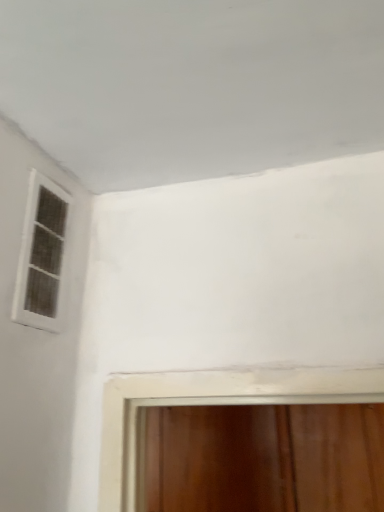
You are a GUI agent. You are given a task and a screenshot of the screen. Output one action in this format:
    pyautogui.click(x=<x>, y=<y>)
    Task: Click on the white matte window at upper left, arranged as the 1th window when viewed from the front
    The height and width of the screenshot is (512, 384).
    Given the screenshot: What is the action you would take?
    pyautogui.click(x=43, y=256)

What do you see at coordinates (43, 256) in the screenshot? This screenshot has width=384, height=512. I see `white matte window at upper left, the 2th window positioned from the right` at bounding box center [43, 256].

Where is `transparent glass door at bottom, the first window positioned from the bottom`? This screenshot has height=512, width=384. transparent glass door at bottom, the first window positioned from the bottom is located at coordinates (210, 404).

What do you see at coordinates (210, 404) in the screenshot?
I see `transparent glass door at bottom, the first window when ordered from back to front` at bounding box center [210, 404].

Locate an element on the screen. The height and width of the screenshot is (512, 384). white matte window at upper left, the 2th window positioned from the right is located at coordinates click(43, 256).

Which is more to the left, white matte window at upper left, marked as the second window in a back-to-front arrangement, or transparent glass door at bottom, the first window positioned from the bottom?

Positioned to the left is white matte window at upper left, marked as the second window in a back-to-front arrangement.

Between white matte window at upper left, arranged as the second window when ordered from the bottom, and transparent glass door at bottom, the first window positioned from the bottom, which one is positioned in front?

white matte window at upper left, arranged as the second window when ordered from the bottom, is closer to the camera.

Is point (58, 227) closer or farther from the camera than point (105, 507)?

Point (58, 227) appears to be farther away from the viewer than point (105, 507).

From the image's perspective, is white matte window at upper left, which appears as the first window when viewed from the left, positioned above or below transparent glass door at bottom, the first window positioned from the bottom?

Clearly, from the image's perspective, white matte window at upper left, which appears as the first window when viewed from the left, is above transparent glass door at bottom, the first window positioned from the bottom.

From a real-world perspective, is white matte window at upper left, arranged as the 1th window when viewed from the front, on top of transparent glass door at bottom, the 1th window in the right-to-left sequence?

Yes.

Does white matte window at upper left, which appears as the first window when viewed from the left, have a greater width compared to transparent glass door at bottom, the 2th window positioned from the front?

Incorrect, the width of white matte window at upper left, which appears as the first window when viewed from the left, does not surpass that of transparent glass door at bottom, the 2th window positioned from the front.

Who is taller, white matte window at upper left, arranged as the 1th window when viewed from the front, or transparent glass door at bottom, the 1th window in the right-to-left sequence?

transparent glass door at bottom, the 1th window in the right-to-left sequence, is taller.

Which of these two, white matte window at upper left, which appears as the first window when viewed from the left, or transparent glass door at bottom, the first window positioned from the bottom, is smaller?

With smaller size is white matte window at upper left, which appears as the first window when viewed from the left.

Would you say white matte window at upper left, which appears as the first window when viewed from the left, is inside or outside transparent glass door at bottom, placed as the 2th window when sorted from left to right?

white matte window at upper left, which appears as the first window when viewed from the left, is outside transparent glass door at bottom, placed as the 2th window when sorted from left to right.

Is white matte window at upper left, marked as the second window in a back-to-front arrangement, positioned far away from transparent glass door at bottom, the 2th window from the top?

No, white matte window at upper left, marked as the second window in a back-to-front arrangement, is not far from transparent glass door at bottom, the 2th window from the top.

Does white matte window at upper left, which appears as the first window when viewed from the left, turn towards transparent glass door at bottom, the first window when ordered from back to front?

No, white matte window at upper left, which appears as the first window when viewed from the left, is not aimed at transparent glass door at bottom, the first window when ordered from back to front.

Can you tell me how much white matte window at upper left, marked as the first window in a top-to-bottom arrangement, and transparent glass door at bottom, the 1th window in the right-to-left sequence, differ in facing direction?

They differ by 89.1 degrees in their facing directions.

The width and height of the screenshot is (384, 512). I want to click on window lying on the left of transparent glass door at bottom, placed as the 2th window when sorted from left to right, so click(43, 256).

In the scene shown: Which is more to the right, transparent glass door at bottom, the 2th window from the top, or white matte window at upper left, marked as the second window in a back-to-front arrangement?

From the viewer's perspective, transparent glass door at bottom, the 2th window from the top, appears more on the right side.

Is transparent glass door at bottom, the first window when ordered from back to front, closer to camera compared to white matte window at upper left, the 2th window positioned from the right?

No, transparent glass door at bottom, the first window when ordered from back to front, is behind white matte window at upper left, the 2th window positioned from the right.

Which point is more forward, (111,450) or (35,255)?

Positioned in front is point (35,255).

From the image's perspective, which is below, transparent glass door at bottom, the first window positioned from the bottom, or white matte window at upper left, arranged as the 1th window when viewed from the front?

transparent glass door at bottom, the first window positioned from the bottom, is shown below in the image.

From a real-world perspective, is transparent glass door at bottom, the 1th window in the right-to-left sequence, positioned under white matte window at upper left, marked as the first window in a top-to-bottom arrangement, based on gravity?

Indeed, from a real-world perspective, transparent glass door at bottom, the 1th window in the right-to-left sequence, is positioned beneath white matte window at upper left, marked as the first window in a top-to-bottom arrangement.

Considering the relative sizes of transparent glass door at bottom, the first window when ordered from back to front, and white matte window at upper left, the 2th window positioned from the right, in the image provided, is transparent glass door at bottom, the first window when ordered from back to front, wider than white matte window at upper left, the 2th window positioned from the right,?

Correct, the width of transparent glass door at bottom, the first window when ordered from back to front, exceeds that of white matte window at upper left, the 2th window positioned from the right.

Is transparent glass door at bottom, the 2th window from the top, shorter than white matte window at upper left, the 2th window positioned from the right?

In fact, transparent glass door at bottom, the 2th window from the top, may be taller than white matte window at upper left, the 2th window positioned from the right.

Is transparent glass door at bottom, the first window positioned from the bottom, bigger than white matte window at upper left, the 2th window positioned from the right?

Indeed, transparent glass door at bottom, the first window positioned from the bottom, has a larger size compared to white matte window at upper left, the 2th window positioned from the right.

Is transparent glass door at bottom, the 2th window from the top, surrounding white matte window at upper left, arranged as the 1th window when viewed from the front?

No.

Would you consider transparent glass door at bottom, the 2th window from the top, to be distant from white matte window at upper left, the 2th window positioned from the right?

No, transparent glass door at bottom, the 2th window from the top, is in close proximity to white matte window at upper left, the 2th window positioned from the right.

Is transparent glass door at bottom, the 2th window positioned from the front, turned away from white matte window at upper left, which appears as the first window when viewed from the left?

transparent glass door at bottom, the 2th window positioned from the front, is not turned away from white matte window at upper left, which appears as the first window when viewed from the left.

How far apart are transparent glass door at bottom, placed as the 2th window when sorted from left to right, and white matte window at upper left, the 2th window positioned from the right?

transparent glass door at bottom, placed as the 2th window when sorted from left to right, and white matte window at upper left, the 2th window positioned from the right, are 12.28 inches apart.

In order to click on window below the white matte window at upper left, marked as the second window in a back-to-front arrangement (from the image's perspective) in this screenshot , I will do `click(210, 404)`.

Where is `window below the white matte window at upper left, arranged as the second window when ordered from the bottom (from a real-world perspective)`? window below the white matte window at upper left, arranged as the second window when ordered from the bottom (from a real-world perspective) is located at coordinates (210, 404).

Find the location of `window above the transparent glass door at bottom, the 1th window in the right-to-left sequence (from a real-world perspective)`. window above the transparent glass door at bottom, the 1th window in the right-to-left sequence (from a real-world perspective) is located at coordinates (43, 256).